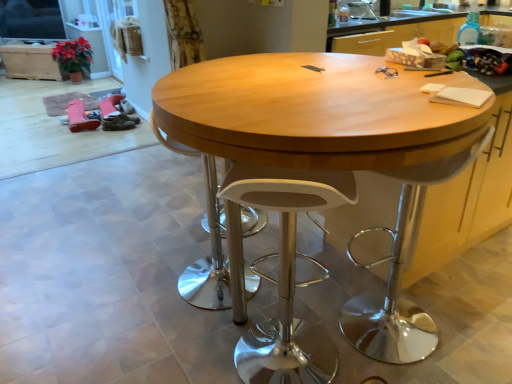
Locate an element on the screen. This screenshot has width=512, height=384. free space behind white plastic swivel chair at right, which is counted as the 2th swivel chair, starting from the left is located at coordinates (357, 279).